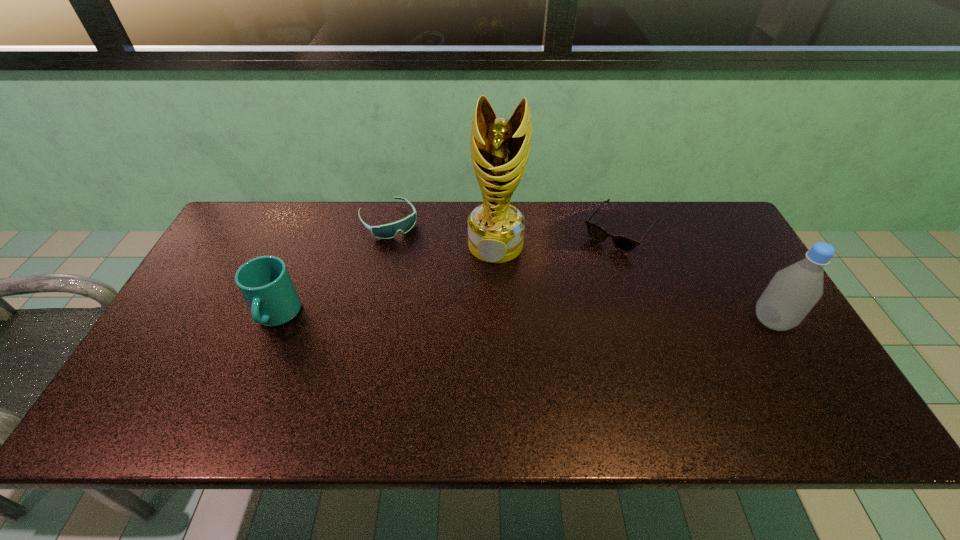
You are a GUI agent. You are given a task and a screenshot of the screen. Output one action in this format:
    pyautogui.click(x=<x>, y=<y>)
    Task: Click on the free space located on the front-facing side of the third object from right to left
    
    Given the screenshot: What is the action you would take?
    pyautogui.click(x=469, y=355)

Find the location of a particular element. vacant space situated 0.150m on the front-facing side of the third object from right to left is located at coordinates (482, 301).

Image resolution: width=960 pixels, height=540 pixels. What are the coordinates of `free space located 0.120m on the front-facing side of the third object from right to left` in the screenshot? It's located at (484, 293).

Image resolution: width=960 pixels, height=540 pixels. What are the coordinates of `vacant space situated on the front lenses of the second object from right to left` in the screenshot? It's located at (558, 308).

I want to click on free space located 0.150m on the front lenses of the second object from right to left, so click(x=581, y=280).

What are the coordinates of `free region located on the front lenses of the second object from right to left` in the screenshot? It's located at (555, 313).

Locate an element on the screen. Image resolution: width=960 pixels, height=540 pixels. blank space located 0.400m on the front-facing side of the second object from left to right is located at coordinates (463, 323).

At what (x,y) coordinates should I click in order to perform the action: click on free spot located 0.360m on the front-facing side of the second object from left to right. Please return your answer as a coordinate pair (x, y). Looking at the image, I should click on click(455, 313).

Locate an element on the screen. Image resolution: width=960 pixels, height=540 pixels. vacant space positioned on the front-facing side of the second object from left to right is located at coordinates (442, 294).

Identify the location of award that is positioned at the far edge. (500, 148).